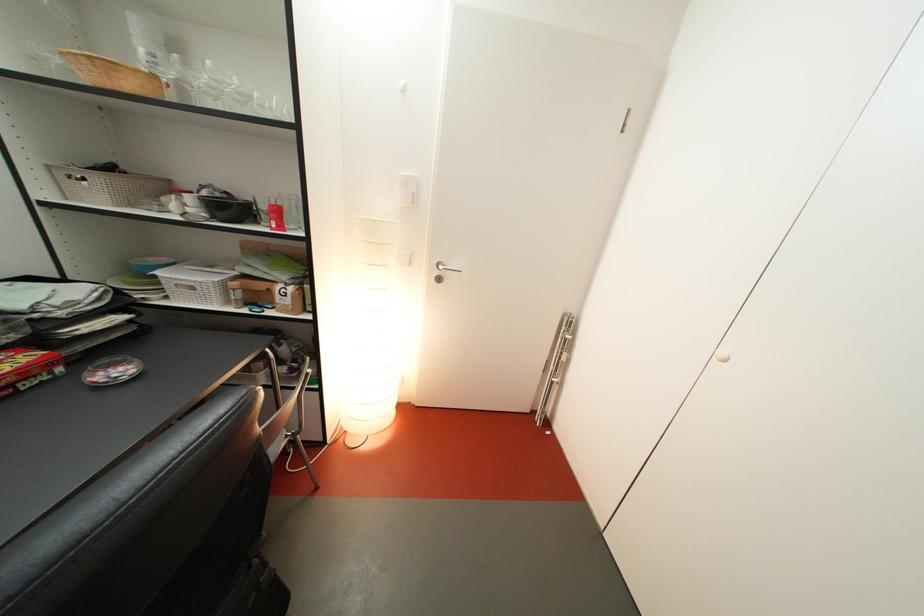
At what (x,y) coordinates should I click in order to perform the action: click on wicker basket. Please return your answer as a coordinate pair (x, y). Looking at the image, I should click on (106, 185).